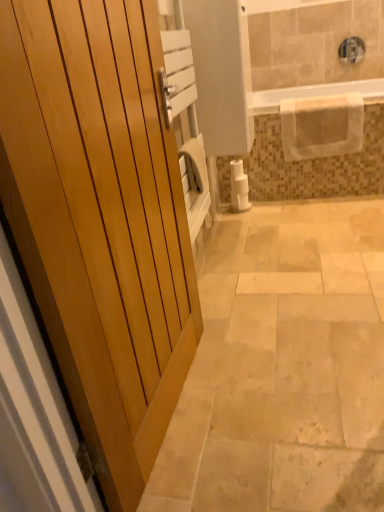
Question: From a real-world perspective, is clear plastic bathtub at upper center above or below wooden door at left?

Choices:
 (A) below
 (B) above

Answer: (A)

Question: Is clear plastic bathtub at upper center wider or thinner than wooden door at left?

Choices:
 (A) thin
 (B) wide

Answer: (B)

Question: Which is farther from the clear plastic bathtub at upper center?

Choices:
 (A) white matte toilet paper at center-right
 (B) wooden door at left

Answer: (B)

Question: Based on their relative distances, which object is farther from the clear plastic bathtub at upper center?

Choices:
 (A) wooden door at left
 (B) white matte toilet paper at center-right

Answer: (A)